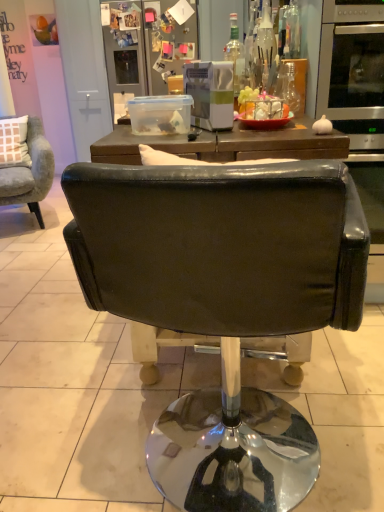
Question: From their relative heights in the image, would you say metallic silver refrigerator at upper center is taller or shorter than transparent glass bottle at upper right, which ranks as the third bottle in left-to-right order?

Choices:
 (A) short
 (B) tall

Answer: (B)

Question: Based on their sizes in the image, would you say metallic silver refrigerator at upper center is bigger or smaller than transparent glass bottle at upper right, which ranks as the third bottle in left-to-right order?

Choices:
 (A) big
 (B) small

Answer: (A)

Question: Which object is positioned closest to the metallic silver refrigerator at upper center?

Choices:
 (A) stainless steel oven at right
 (B) transparent glass bottle at upper center, the 3th bottle when ordered from right to left
 (C) velvet grey armchair at left, arranged as the first chair when viewed from the top
 (D) clear glass bottle at upper center, which ranks as the 1th bottle in left-to-right order
 (E) black leather chair at center, the second chair positioned from the top

Answer: (C)

Question: Which of these objects is positioned farthest from the transparent glass bottle at upper center, the second bottle when ordered from left to right?

Choices:
 (A) stainless steel oven at right
 (B) velvet grey armchair at left, positioned as the 1th chair in back-to-front order
 (C) transparent glass bottle at upper right, which is counted as the second bottle, starting from the right
 (D) metallic silver refrigerator at upper center
 (E) clear glass bottle at upper center, which ranks as the 1th bottle in left-to-right order

Answer: (D)